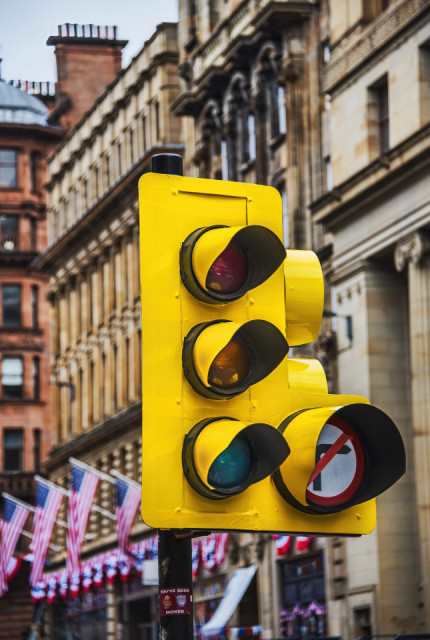
The height and width of the screenshot is (640, 430). What are the coordinates of `door` in the screenshot? It's located at (296, 627).